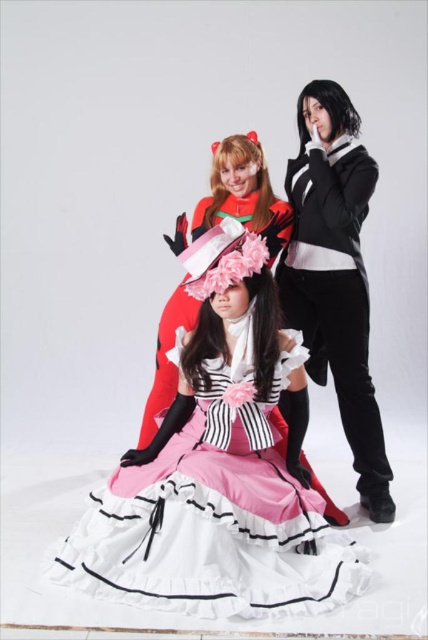
You are a photographer standing in front of the black matte jacket at center. You want to take a closeup shot of the jacket without moving any objects. What is the minimum distance you need to maintain from the jacket to ensure clarity?

The black matte jacket at center and viewer are 2.18 meters apart, so you need to maintain at least 2.18 meters distance to ensure clarity.

In the scene shown: You are a costume designer trying to decide which item to place on a narrow mannequin stand. The stand can only accommodate items with a width of 30 cm or less. You have the black matte jacket at center and the matte black dress at center. Based on their widths, which item would you choose to fit on the stand?

The black matte jacket at center is thinner than the matte black dress at center, so the black matte jacket at center would fit on the stand since it is narrower than 30 cm.

You are a photographer in the studio and want to adjust the lighting to highlight the matte pink dress at center and the black matte jacket at center. Since the two items are at the same position, which one should you focus on first to ensure proper lighting?

The matte pink dress at center is closer to the viewer than the black matte jacket at center, so you should focus on the matte pink dress at center first to ensure proper lighting.